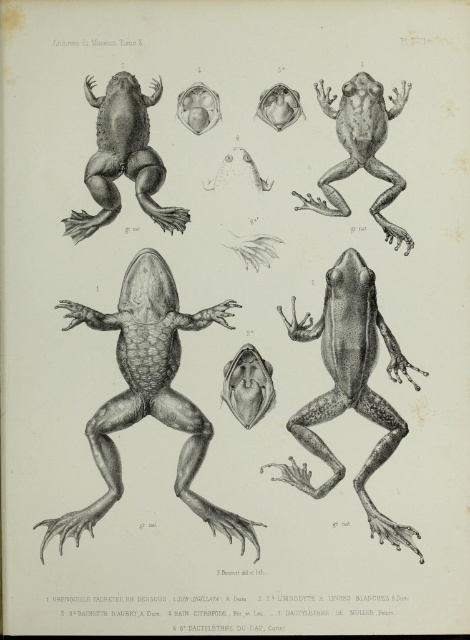
Question: From the image, what is the correct spatial relationship of smooth black frog at center in relation to gray textured frog at center?

Choices:
 (A) right
 (B) left

Answer: (B)

Question: Is smooth black frog at center wider than gray textured frog at center?

Choices:
 (A) yes
 (B) no

Answer: (A)

Question: Is smooth gray frog at center thinner than gray textured frog at center?

Choices:
 (A) yes
 (B) no

Answer: (B)

Question: Which of the following is the farthest from the observer?

Choices:
 (A) smooth black frog at upper left
 (B) smooth black frog at center

Answer: (A)

Question: Which object appears closest to the camera in this image?

Choices:
 (A) smooth gray frog at center
 (B) smooth black frog at center
 (C) smooth black frog at upper left

Answer: (A)

Question: Among these points, which one is farthest from the camera?

Choices:
 (A) (143, 124)
 (B) (345, 208)
 (C) (371, 465)

Answer: (A)